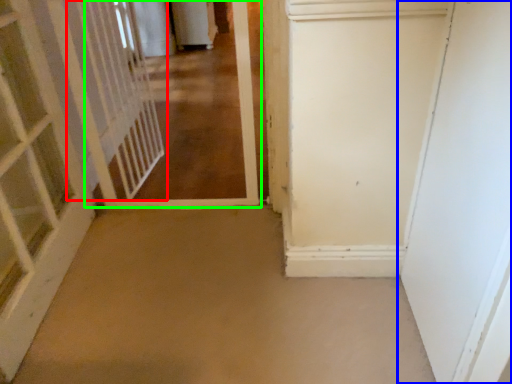
Question: Based on their relative distances, which object is farther from elevator (highlighted by a red box)? Choose from door (highlighted by a blue box) and corridor (highlighted by a green box).

Choices:
 (A) door
 (B) corridor

Answer: (A)